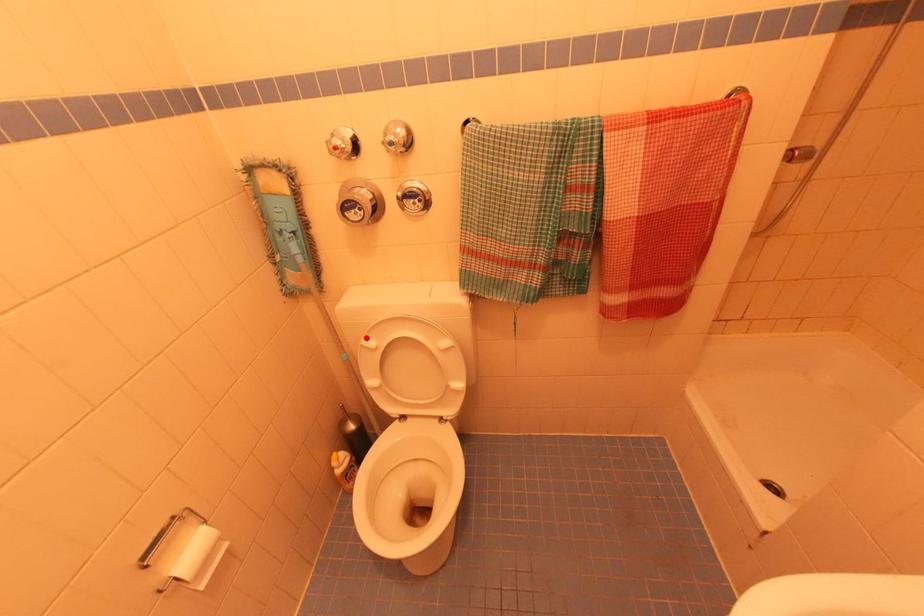
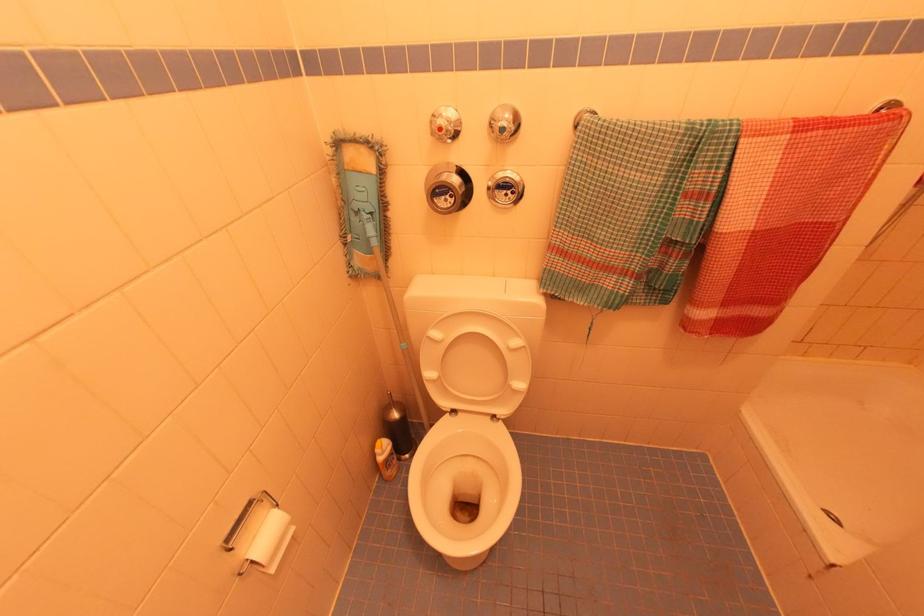
Locate, in the second image, the point that corresponds to the highlighted location in the first image.

(433, 329)